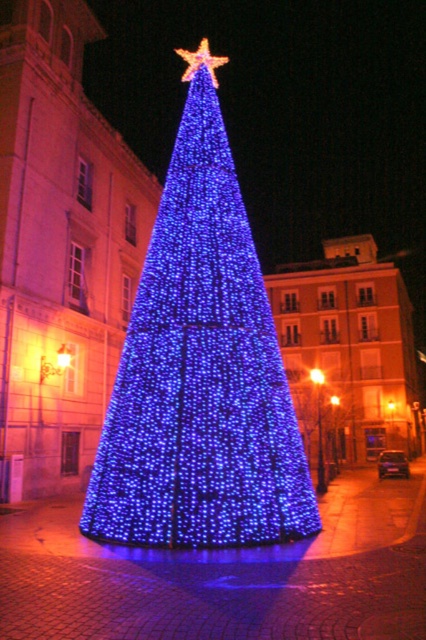
Question: Where is blue led lights at center located in relation to bright orange light at center in the image?

Choices:
 (A) left
 (B) right

Answer: (A)

Question: Which point appears closest to the camera in this image?

Choices:
 (A) (195, 70)
 (B) (247, 538)

Answer: (B)

Question: Which of the following is the farthest from the observer?

Choices:
 (A) (146, 282)
 (B) (321, 381)

Answer: (B)

Question: Does gold metallic star at upper center have a smaller size compared to bright orange light at center?

Choices:
 (A) yes
 (B) no

Answer: (B)

Question: Is gold metallic star at upper center closer to the viewer compared to bright orange light at center?

Choices:
 (A) yes
 (B) no

Answer: (A)

Question: Which object is the closest to the bright orange light at center?

Choices:
 (A) blue led lights at center
 (B) gold metallic star at upper center

Answer: (A)